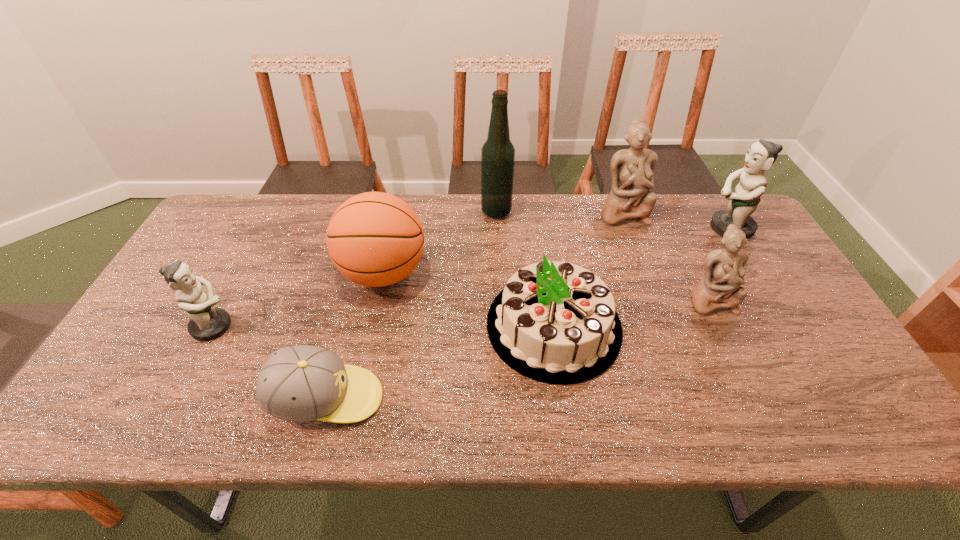
This screenshot has width=960, height=540. In order to click on green alcohol in this screenshot , I will do `click(498, 153)`.

Where is `the tallest object`? the tallest object is located at coordinates (498, 153).

Locate an element on the screen. Image resolution: width=960 pixels, height=540 pixels. the bigger white figurine is located at coordinates (632, 170).

Locate an element on the screen. This screenshot has width=960, height=540. the farther white figurine is located at coordinates (632, 170).

Find the location of `the rightmost object`. the rightmost object is located at coordinates (761, 155).

Find the location of `the farther green figurine`. the farther green figurine is located at coordinates (761, 155).

Where is `orange basketball`? This screenshot has width=960, height=540. orange basketball is located at coordinates (375, 239).

Where is `green birthday cake`? This screenshot has width=960, height=540. green birthday cake is located at coordinates (554, 322).

Find the location of a particular element. the smaller white figurine is located at coordinates (720, 287).

Find the location of a particular element. The height and width of the screenshot is (540, 960). the nearer white figurine is located at coordinates (720, 287).